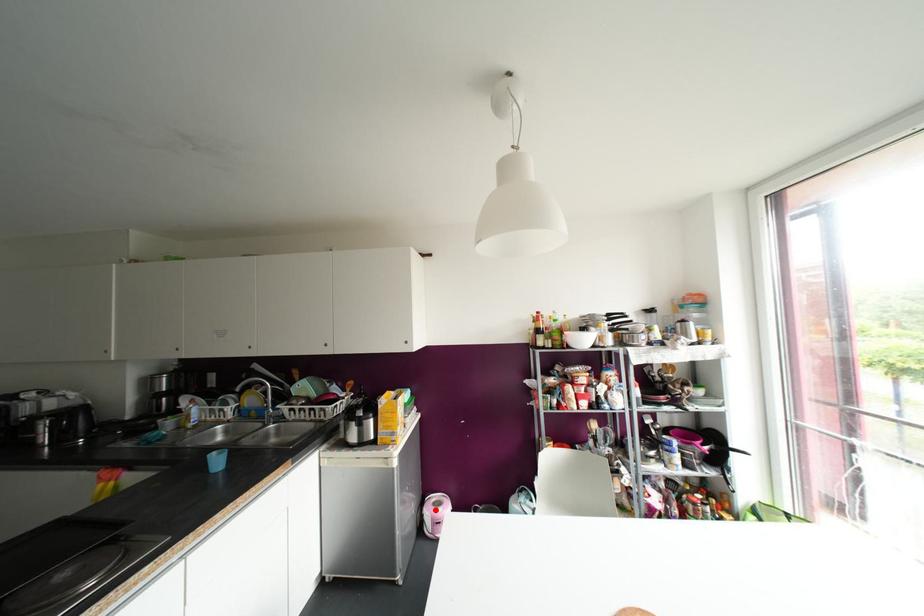
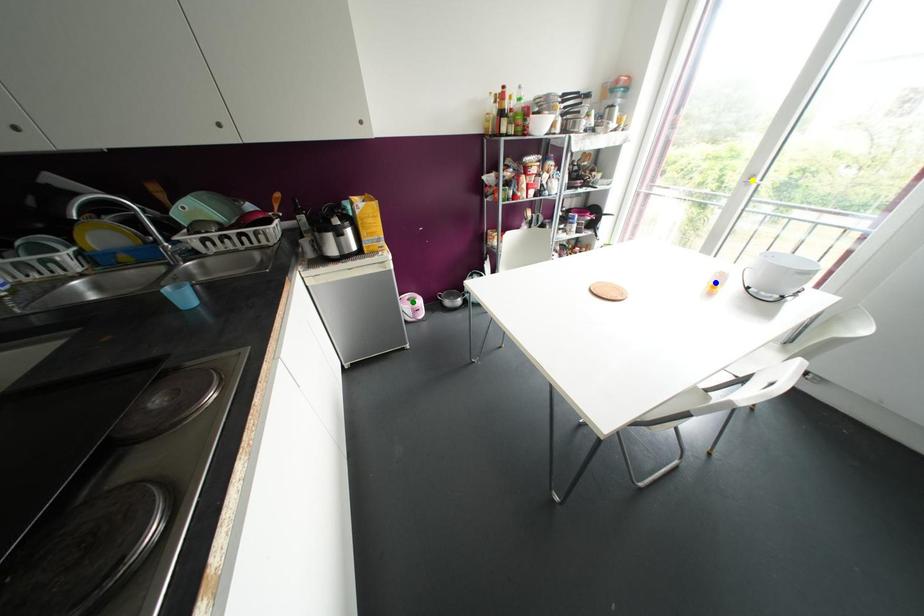
Question: I am providing you with two images of the same scene from different viewpoints. A red point is marked on the first image. You are given multiple points on the second image. Which point in image 2 represents the same 3d spot as the red point in image 1?

Choices:
 (A) blue point
 (B) yellow point
 (C) green point

Answer: (C)